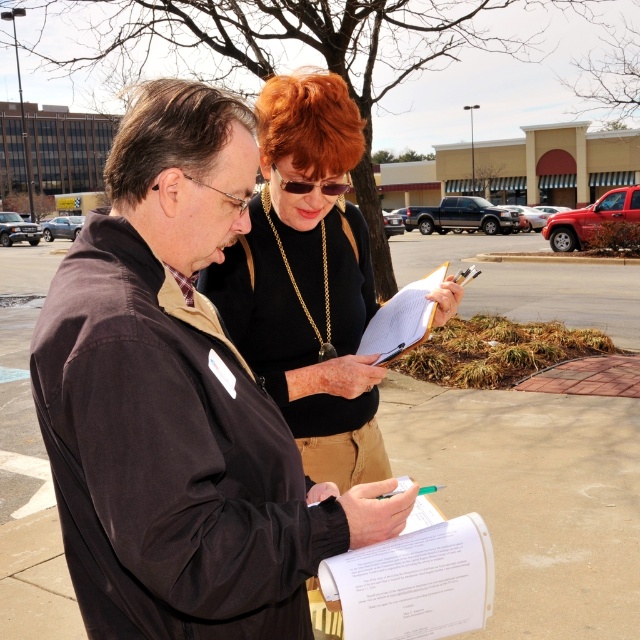
Question: Based on their relative distances, which object is farther from the white paper at center?

Choices:
 (A) dark brown jacket at center
 (B) black matte shirt at center

Answer: (B)

Question: Estimate the real-world distances between objects in this image. Which object is closer to the white paper at center?

Choices:
 (A) black matte shirt at center
 (B) dark brown jacket at center

Answer: (B)

Question: Can you confirm if black matte shirt at center is thinner than white paper at center?

Choices:
 (A) yes
 (B) no

Answer: (B)

Question: Among these objects, which one is nearest to the camera?

Choices:
 (A) black matte shirt at center
 (B) dark brown jacket at center
 (C) white paper clipboard at center

Answer: (B)

Question: Does white paper at center have a smaller size compared to white paper clipboard at center?

Choices:
 (A) yes
 (B) no

Answer: (A)

Question: From the image, what is the correct spatial relationship of white paper at center in relation to white paper clipboard at center?

Choices:
 (A) left
 (B) right

Answer: (A)